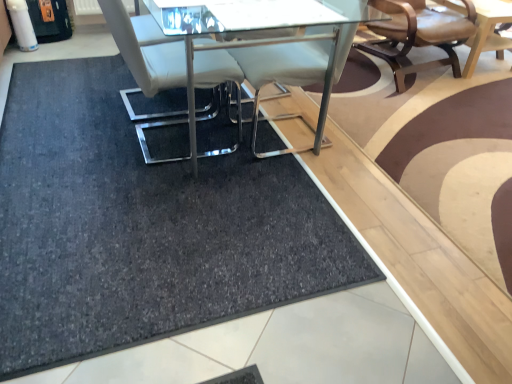
Question: From a real-world perspective, is white leather chair at center, the first chair when ordered from front to back, physically located above or below dark gray carpet at center?

Choices:
 (A) below
 (B) above

Answer: (B)

Question: In the image, is white leather chair at center, the first chair when ordered from front to back, positioned in front of or behind dark gray carpet at center?

Choices:
 (A) behind
 (B) front

Answer: (A)

Question: Estimate the real-world distances between objects in this image. Which object is closer to the light brown wooden table at upper right, which is counted as the 1th table, starting from the back?

Choices:
 (A) white leather chair at center, the first chair when ordered from front to back
 (B) clear glass table at center, which ranks as the first table in front-to-back order
 (C) dark gray carpet at center
 (D) leather seat at upper right, placed as the 2th chair when sorted from left to right

Answer: (D)

Question: Based on their relative distances, which object is nearer to the light brown wooden table at upper right, the 2th table from the left?

Choices:
 (A) dark gray carpet at center
 (B) clear glass table at center, the 2th table positioned from the back
 (C) leather seat at upper right, the second chair viewed from the front
 (D) white leather chair at center, which is counted as the 2th chair, starting from the right

Answer: (C)